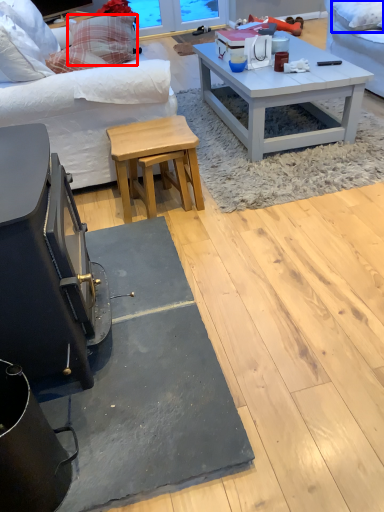
Question: Which object is further to the camera taking this photo, pillow (highlighted by a red box) or pillow (highlighted by a blue box)?

Choices:
 (A) pillow
 (B) pillow

Answer: (A)